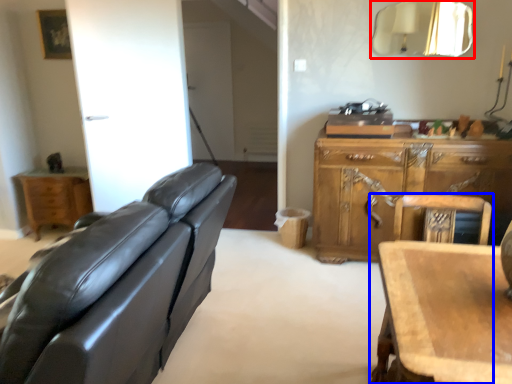
Question: Which of the following is the closest to the observer, mirror (highlighted by a red box) or chair (highlighted by a blue box)?

Choices:
 (A) mirror
 (B) chair

Answer: (B)